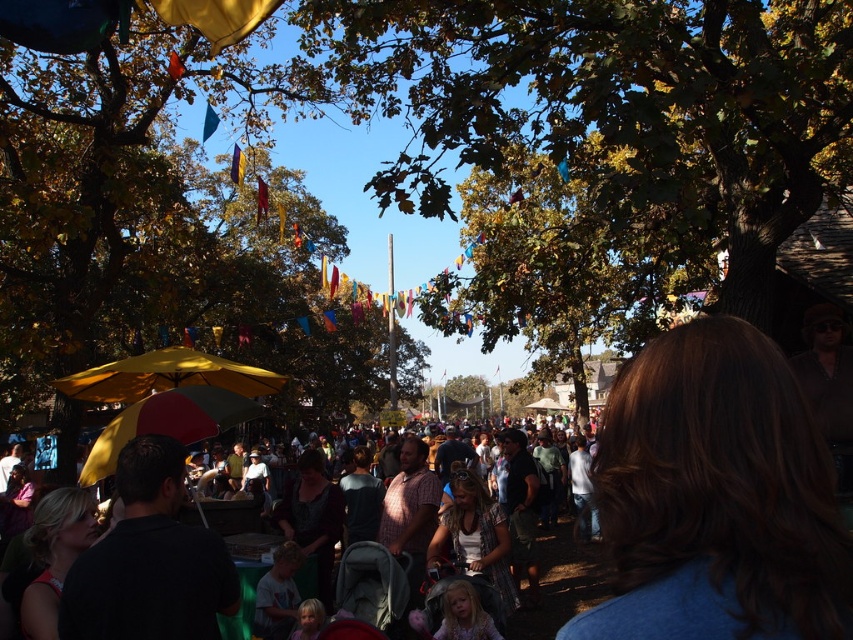
Who is taller, green leafy tree at center or matte gray stroller at center?

green leafy tree at center is taller.

Between green leafy tree at center and matte gray stroller at center, which one has less height?

matte gray stroller at center

What are the coordinates of `green leafy tree at center` in the screenshot? It's located at (161, 214).

Locate an element on the screen. The image size is (853, 640). green leafy tree at center is located at coordinates (161, 214).

Who is positioned more to the left, brown hair at center or matte gray stroller at center?

brown hair at center is more to the left.

What do you see at coordinates (717, 497) in the screenshot? I see `brown hair at center` at bounding box center [717, 497].

Locate an element on the screen. The image size is (853, 640). brown hair at center is located at coordinates (717, 497).

Can you confirm if brown hair at center is taller than yellow matte umbrella at center?

No.

Does brown hair at center come behind yellow matte umbrella at center?

No, it is not.

Which is in front, point (775, 595) or point (216, 432)?

Point (775, 595)

The width and height of the screenshot is (853, 640). Identify the location of brown hair at center. (717, 497).